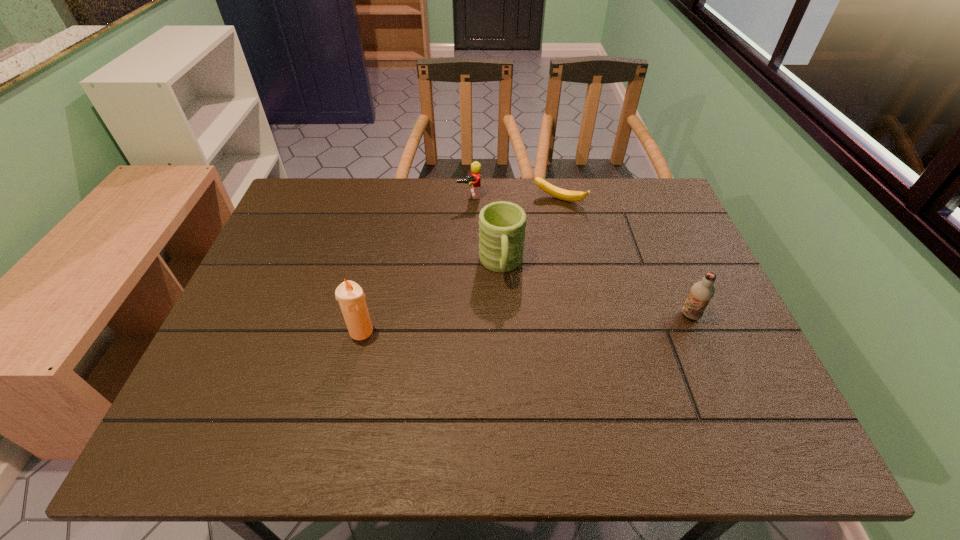
Locate an element on the screen. The width and height of the screenshot is (960, 540). free space between the Lego and the candle is located at coordinates (415, 264).

Find the location of `vacant area between the shortest object and the second shortest object`. vacant area between the shortest object and the second shortest object is located at coordinates (515, 198).

Where is `vacant space in between the second object from right to left and the fourth tallest object`? vacant space in between the second object from right to left and the fourth tallest object is located at coordinates (515, 198).

You are a GUI agent. You are given a task and a screenshot of the screen. Output one action in this format:
    pyautogui.click(x=<x>, y=<y>)
    Task: Click on the vacant space in between the Lego and the banana
    
    Given the screenshot: What is the action you would take?
    coord(515,198)

Where is `vacant area between the leftmost object and the banana`? vacant area between the leftmost object and the banana is located at coordinates (460, 266).

Identify the location of free area in between the tallest object and the chocolate milk. Image resolution: width=960 pixels, height=540 pixels. (526, 323).

Where is `object that can be found as the second closest to the shortest object`? object that can be found as the second closest to the shortest object is located at coordinates (474, 180).

Identify which object is located as the third nearest to the Lego. Please provide its 2D coordinates. Your answer should be formatted as a tuple, i.e. [(x, y)], where the tuple contains the x and y coordinates of a point satisfying the conditions above.

[(351, 298)]

Where is `vacant position in the image that satisfies the following two spatial constraints: 1. on the back side of the chocolate milk; 2. on the right side of the leftmost object`? This screenshot has height=540, width=960. vacant position in the image that satisfies the following two spatial constraints: 1. on the back side of the chocolate milk; 2. on the right side of the leftmost object is located at coordinates (365, 315).

This screenshot has height=540, width=960. I want to click on vacant area in the image that satisfies the following two spatial constraints: 1. on the front side of the Lego; 2. on the right side of the banana, so click(x=469, y=200).